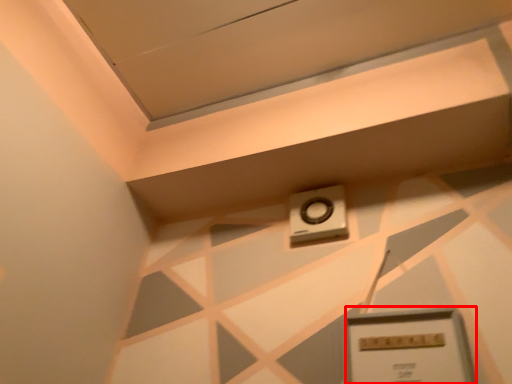
Question: From the image's perspective, considering the relative positions of rectangle (annotated by the red box) and alarm in the image provided, where is rectangle (annotated by the red box) located with respect to the staircase?

Choices:
 (A) above
 (B) below

Answer: (B)